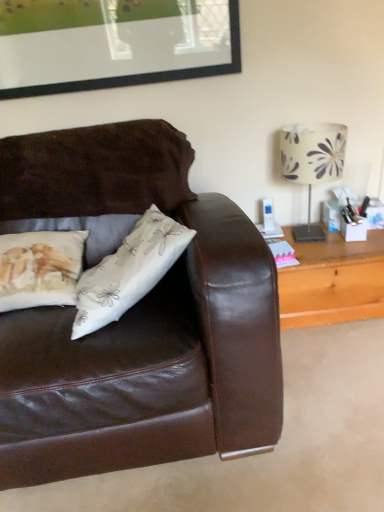
Image resolution: width=384 pixels, height=512 pixels. What do you see at coordinates (312, 163) in the screenshot?
I see `white floral-patterned lampshade at upper right` at bounding box center [312, 163].

In order to face white floral-patterned lampshade at upper right, should I rotate leftwards or rightwards?

To face it directly, rotate right by 15.828 degrees.

Image resolution: width=384 pixels, height=512 pixels. I want to click on white floral-patterned lampshade at upper right, so click(x=312, y=163).

In order to face wooden table at right, should I rotate leftwards or rightwards?

You should rotate right by 18.316 degrees.

This screenshot has height=512, width=384. What do you see at coordinates (332, 280) in the screenshot?
I see `wooden table at right` at bounding box center [332, 280].

At what (x,y) coordinates should I click in order to perform the action: click on wooden table at right. Please return your answer as a coordinate pair (x, y). The height and width of the screenshot is (512, 384). Looking at the image, I should click on (332, 280).

You are a GUI agent. You are given a task and a screenshot of the screen. Output one action in this format:
    pyautogui.click(x=<x>, y=<y>)
    Task: Click on the white floral-patterned lampshade at upper right
    Image resolution: width=384 pixels, height=512 pixels.
    Given the screenshot: What is the action you would take?
    pyautogui.click(x=312, y=163)

Considering the positions of objects white floral-patterned lampshade at upper right and wooden table at right in the image provided, who is more to the left, white floral-patterned lampshade at upper right or wooden table at right?

From the viewer's perspective, white floral-patterned lampshade at upper right appears more on the left side.

Relative to wooden table at right, is white floral-patterned lampshade at upper right in front or behind?

white floral-patterned lampshade at upper right is in front of wooden table at right.

Between point (313, 123) and point (347, 280), which one is positioned behind?

The point (313, 123) is more distant.

From the image's perspective, relative to wooden table at right, is white floral-patterned lampshade at upper right above or below?

white floral-patterned lampshade at upper right is above wooden table at right.

From a real-world perspective, is white floral-patterned lampshade at upper right physically above wooden table at right?

Yes, from a real-world perspective, white floral-patterned lampshade at upper right is over wooden table at right

Is white floral-patterned lampshade at upper right wider or thinner than wooden table at right?

Considering their sizes, white floral-patterned lampshade at upper right looks slimmer than wooden table at right.

From their relative heights in the image, would you say white floral-patterned lampshade at upper right is taller or shorter than wooden table at right?

Considering their sizes, white floral-patterned lampshade at upper right has more height than wooden table at right.

Is white floral-patterned lampshade at upper right bigger than wooden table at right?

Actually, white floral-patterned lampshade at upper right might be smaller than wooden table at right.

Is wooden table at right completely or partially inside white floral-patterned lampshade at upper right?

No, wooden table at right is not surrounded by white floral-patterned lampshade at upper right.

Are white floral-patterned lampshade at upper right and wooden table at right located far from each other?

white floral-patterned lampshade at upper right is actually quite close to wooden table at right.

Does white floral-patterned lampshade at upper right turn towards wooden table at right?

No, white floral-patterned lampshade at upper right is not turned towards wooden table at right.

Measure the distance from white floral-patterned lampshade at upper right to wooden table at right.

white floral-patterned lampshade at upper right and wooden table at right are 9.63 inches apart.

Where is `table lamp that is in front of the wooden table at right`? table lamp that is in front of the wooden table at right is located at coordinates (312, 163).

Can you confirm if wooden table at right is positioned to the right of white floral-patterned lampshade at upper right?

Indeed, wooden table at right is positioned on the right side of white floral-patterned lampshade at upper right.

Does wooden table at right come in front of white floral-patterned lampshade at upper right?

No.

Is point (287, 320) in front of point (324, 148)?

No, (287, 320) is further to viewer.

From the image's perspective, which one is positioned lower, wooden table at right or white floral-patterned lampshade at upper right?

wooden table at right.

From a real-world perspective, which is physically above, wooden table at right or white floral-patterned lampshade at upper right?

From a 3D spatial view, white floral-patterned lampshade at upper right is above.

Is wooden table at right wider or thinner than white floral-patterned lampshade at upper right?

wooden table at right is wider than white floral-patterned lampshade at upper right.

Between wooden table at right and white floral-patterned lampshade at upper right, which one has more height?

With more height is white floral-patterned lampshade at upper right.

Looking at the image, does wooden table at right seem bigger or smaller compared to white floral-patterned lampshade at upper right?

Considering their sizes, wooden table at right takes up more space than white floral-patterned lampshade at upper right.

Is wooden table at right inside the boundaries of white floral-patterned lampshade at upper right, or outside?

wooden table at right is not inside white floral-patterned lampshade at upper right, it's outside.

Is wooden table at right not near white floral-patterned lampshade at upper right?

wooden table at right is actually quite close to white floral-patterned lampshade at upper right.

Is wooden table at right turned away from white floral-patterned lampshade at upper right?

No, wooden table at right is not facing the opposite direction of white floral-patterned lampshade at upper right.

Can you tell me how much wooden table at right and white floral-patterned lampshade at upper right differ in facing direction?

There is a 4.94-degree angle between the facing directions of wooden table at right and white floral-patterned lampshade at upper right.

Find the location of `table lamp on the left of wooden table at right`. table lamp on the left of wooden table at right is located at coordinates (312, 163).

This screenshot has width=384, height=512. Find the location of `table lamp on the left of wooden table at right`. table lamp on the left of wooden table at right is located at coordinates (312, 163).

You are a GUI agent. You are given a task and a screenshot of the screen. Output one action in this format:
    pyautogui.click(x=<x>, y=<y>)
    Task: Click on the table located on the right of white floral-patterned lampshade at upper right
    The width and height of the screenshot is (384, 512).
    Given the screenshot: What is the action you would take?
    332,280